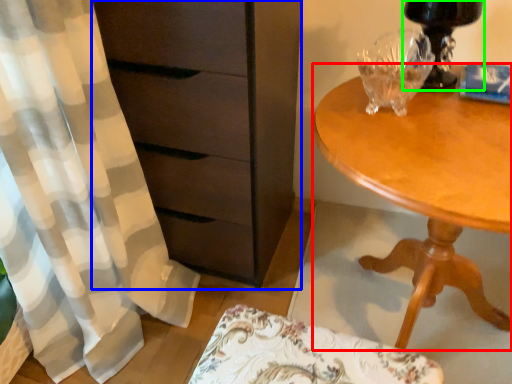
Question: Considering the real-world distances, which object is farthest from desk (highlighted by a red box)? chest of drawers (highlighted by a blue box) or table lamp (highlighted by a green box)?

Choices:
 (A) chest of drawers
 (B) table lamp

Answer: (A)